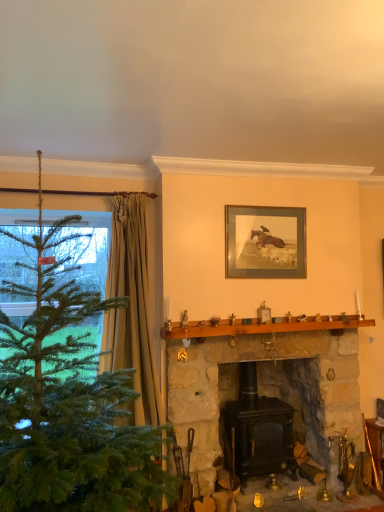
Question: Is black matte wood stove at center, the 1th fireplace in the right-to-left sequence, bigger than wooden frame at upper center?

Choices:
 (A) yes
 (B) no

Answer: (A)

Question: Considering the relative sizes of black matte wood stove at center, acting as the second fireplace starting from the left, and wooden frame at upper center in the image provided, is black matte wood stove at center, acting as the second fireplace starting from the left, thinner than wooden frame at upper center?

Choices:
 (A) no
 (B) yes

Answer: (A)

Question: Can you confirm if black matte wood stove at center, acting as the second fireplace starting from the left, is positioned to the left of wooden frame at upper center?

Choices:
 (A) yes
 (B) no

Answer: (A)

Question: Is there a large distance between black matte wood stove at center, the 1th fireplace in the right-to-left sequence, and wooden frame at upper center?

Choices:
 (A) no
 (B) yes

Answer: (B)

Question: Are black matte wood stove at center, the 1th fireplace in the right-to-left sequence, and wooden frame at upper center beside each other?

Choices:
 (A) yes
 (B) no

Answer: (B)

Question: Is point (372, 425) closer or farther from the camera than point (339, 326)?

Choices:
 (A) farther
 (B) closer

Answer: (A)

Question: Is wooden fireplace tools at lower right inside or outside of stone fireplace at center, which is the 1th fireplace in left-to-right order?

Choices:
 (A) outside
 (B) inside

Answer: (A)

Question: Would you say wooden fireplace tools at lower right is to the left or to the right of stone fireplace at center, the 2th fireplace viewed from the right, in the picture?

Choices:
 (A) left
 (B) right

Answer: (B)

Question: Considering the positions of wooden fireplace tools at lower right and stone fireplace at center, the 2th fireplace viewed from the right, in the image, is wooden fireplace tools at lower right wider or thinner than stone fireplace at center, the 2th fireplace viewed from the right,?

Choices:
 (A) thin
 (B) wide

Answer: (A)

Question: Is point (117, 310) closer or farther from the camera than point (6, 330)?

Choices:
 (A) closer
 (B) farther

Answer: (B)

Question: In the image, is beige textured curtain at left positioned in front of or behind green matte christmas tree at left?

Choices:
 (A) behind
 (B) front

Answer: (A)

Question: In terms of size, does beige textured curtain at left appear bigger or smaller than green matte christmas tree at left?

Choices:
 (A) small
 (B) big

Answer: (A)

Question: Is beige textured curtain at left taller or shorter than green matte christmas tree at left?

Choices:
 (A) tall
 (B) short

Answer: (B)

Question: Looking at the image, does beige textured curtain at left seem bigger or smaller compared to stone fireplace at center, the 2th fireplace viewed from the right?

Choices:
 (A) small
 (B) big

Answer: (A)

Question: Looking at their shapes, would you say beige textured curtain at left is wider or thinner than stone fireplace at center, which is the 1th fireplace in left-to-right order?

Choices:
 (A) wide
 (B) thin

Answer: (B)